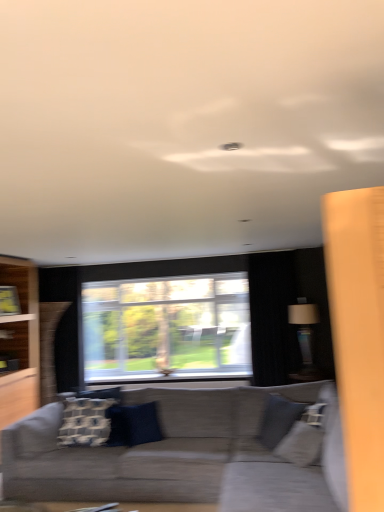
Question: Can you confirm if white textured pillow at center, the 2th pillow positioned from the right, is shorter than gray fabric swivel chair at lower right?

Choices:
 (A) yes
 (B) no

Answer: (A)

Question: From the image's perspective, is white textured pillow at center, the 2th pillow positioned from the right, located above gray fabric swivel chair at lower right?

Choices:
 (A) yes
 (B) no

Answer: (B)

Question: From a real-world perspective, is white textured pillow at center, the 2th pillow positioned from the right, over gray fabric swivel chair at lower right?

Choices:
 (A) yes
 (B) no

Answer: (A)

Question: From the image's perspective, is white textured pillow at center, the 2th pillow positioned from the right, beneath gray fabric swivel chair at lower right?

Choices:
 (A) no
 (B) yes

Answer: (B)

Question: Does white textured pillow at center, the 2th pillow positioned from the right, have a lesser width compared to gray fabric swivel chair at lower right?

Choices:
 (A) no
 (B) yes

Answer: (B)

Question: Would you say white textured pillow at center, the 2th pillow positioned from the right, is to the left or to the right of textured gray couch at center in the picture?

Choices:
 (A) left
 (B) right

Answer: (A)

Question: Do you think white textured pillow at center, which is counted as the first pillow, starting from the left, is within textured gray couch at center, or outside of it?

Choices:
 (A) inside
 (B) outside

Answer: (A)

Question: Is white textured pillow at center, which is counted as the first pillow, starting from the left, bigger or smaller than textured gray couch at center?

Choices:
 (A) small
 (B) big

Answer: (A)

Question: Looking at their shapes, would you say white textured pillow at center, the 2th pillow positioned from the right, is wider or thinner than textured gray couch at center?

Choices:
 (A) wide
 (B) thin

Answer: (B)

Question: In terms of width, does white textured pillow at center, the 2th pillow positioned from the right, look wider or thinner when compared to transparent glass window at center?

Choices:
 (A) thin
 (B) wide

Answer: (A)

Question: Would you say white textured pillow at center, the 2th pillow positioned from the right, is inside or outside transparent glass window at center?

Choices:
 (A) inside
 (B) outside

Answer: (B)

Question: Would you say white textured pillow at center, which is counted as the first pillow, starting from the left, is to the left or to the right of transparent glass window at center in the picture?

Choices:
 (A) right
 (B) left

Answer: (B)

Question: From a real-world perspective, is white textured pillow at center, the 2th pillow positioned from the right, above or below transparent glass window at center?

Choices:
 (A) above
 (B) below

Answer: (B)

Question: Is point (279, 342) positioned closer to the camera than point (185, 408)?

Choices:
 (A) farther
 (B) closer

Answer: (A)

Question: Looking at the image, does black fabric curtain at right seem bigger or smaller compared to textured gray couch at center?

Choices:
 (A) big
 (B) small

Answer: (B)